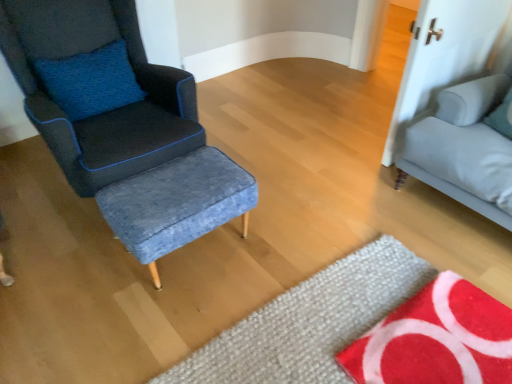
Where is `free area in between light gray fabric studio couch at right and denim fabric stool at center`? free area in between light gray fabric studio couch at right and denim fabric stool at center is located at coordinates (331, 226).